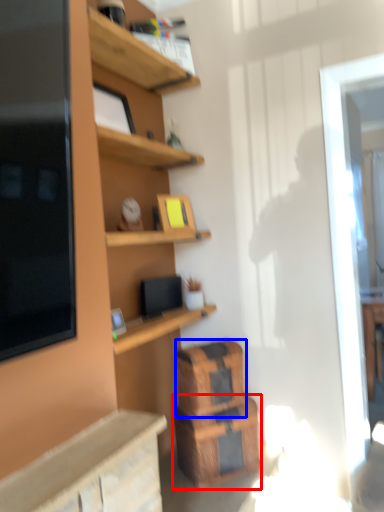
Question: Which object appears closest to the camera in this image, crate (highlighted by a red box) or crate (highlighted by a blue box)?

Choices:
 (A) crate
 (B) crate

Answer: (A)